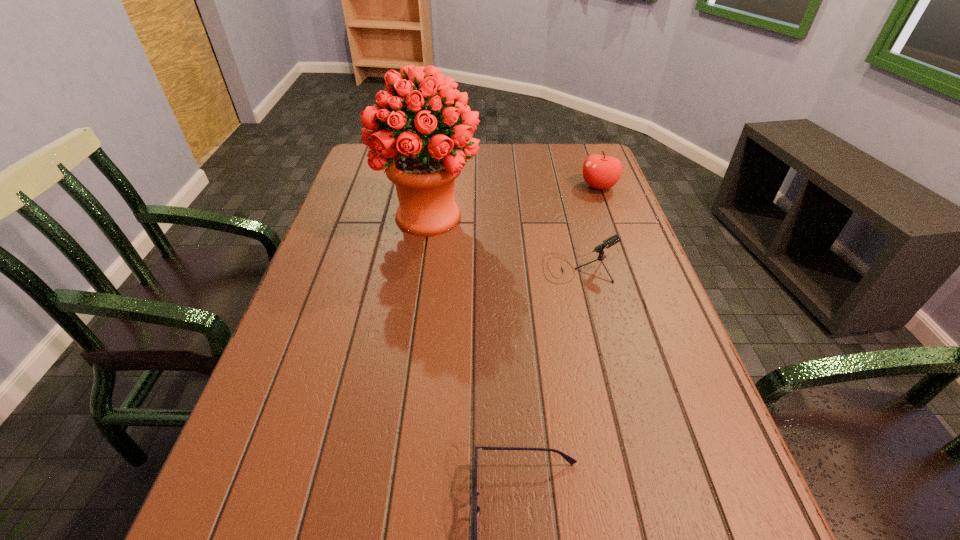
Identify the location of vacant space in between the tallest object and the microphone. (503, 242).

Where is `free space between the bouquet and the microphone`? The width and height of the screenshot is (960, 540). free space between the bouquet and the microphone is located at coordinates (503, 242).

Find the location of a particular element. The height and width of the screenshot is (540, 960). the closest object to the tallest object is located at coordinates (616, 238).

Identify which object is the second closest to the second nearest object. Please provide its 2D coordinates. Your answer should be formatted as a tuple, i.e. [(x, y)], where the tuple contains the x and y coordinates of a point satisfying the conditions above.

[(602, 172)]